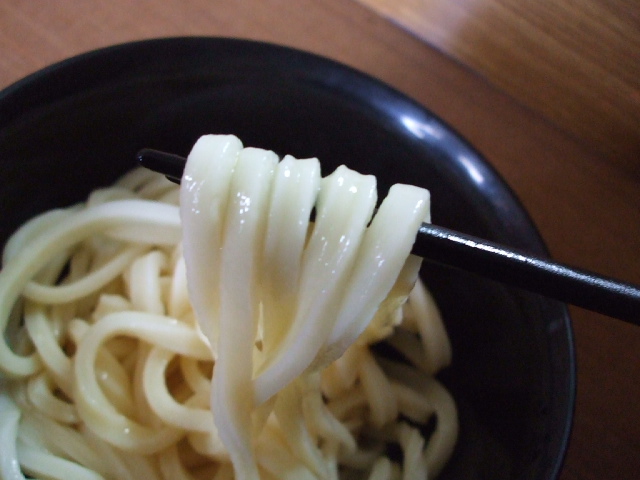
What are the coordinates of `reflection on the table` in the screenshot? It's located at (438, 34).